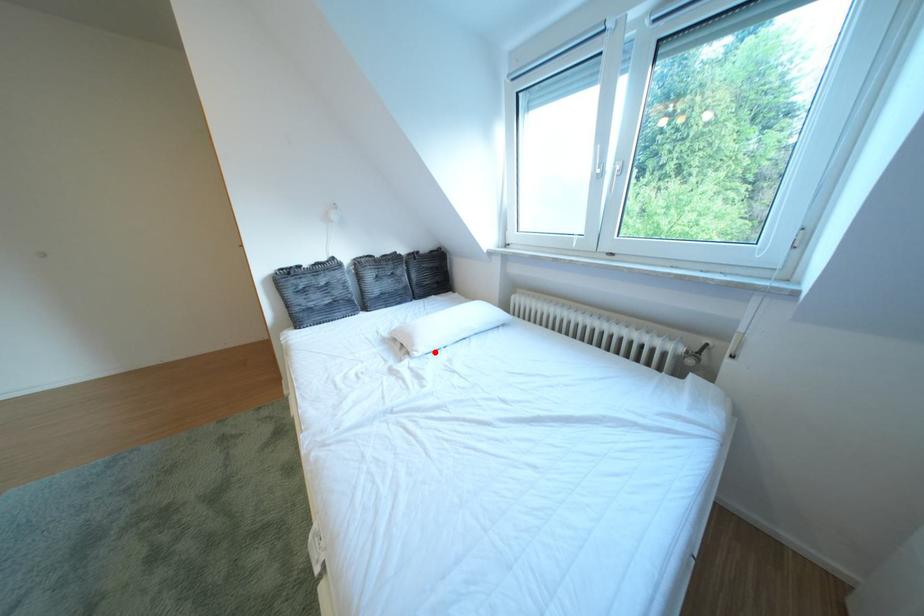
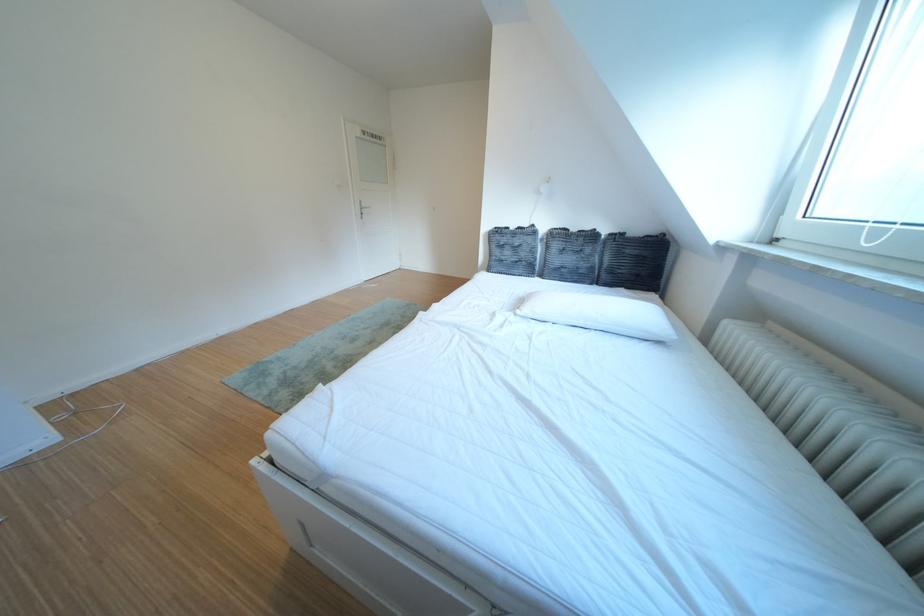
Where in the second image is the point corresponding to the highlighted location from the first image?

(540, 314)